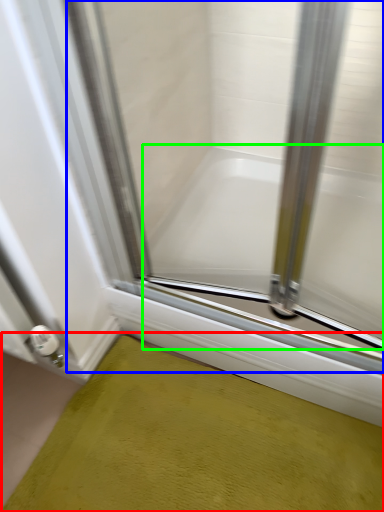
Question: Which is nearer to the bath mat (highlighted by a red box)? glass door (highlighted by a blue box) or bathtub (highlighted by a green box).

Choices:
 (A) glass door
 (B) bathtub

Answer: (B)